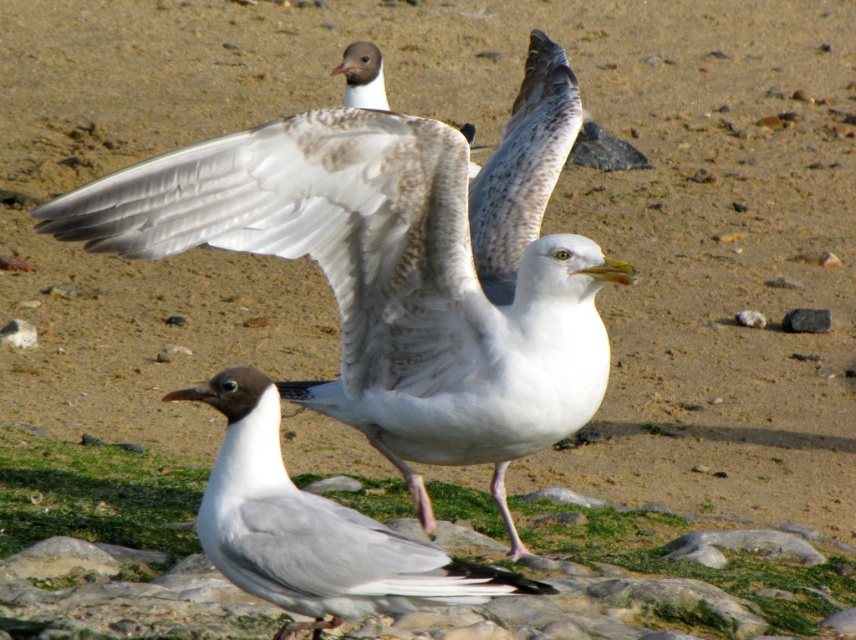
You are a photographer trying to capture a seagull in the center of your frame. The camera has a grid overlay with coordinates from 0 to 1 on both the x and y axes. According to the scene, where should you aim your camera to focus on the white feathered bird at center?

The white feathered bird at center is located at the 2D coordinates point of (400, 266). So you should aim your camera at that point to focus on the white feathered bird at center.

You are a photographer aiming to capture a closeup shot of both the white feathered bird at center and the gray matte seagull at center. Given that your camera lens has a maximum focus range of 80 centimeters, will you be able to photograph both birds in the same frame without moving the camera?

The white feathered bird at center and the gray matte seagull at center are 90.30 centimeters apart from each other. Since the camera lens has a maximum focus range of 80 centimeters, the distance between them exceeds this range. Therefore, you cannot photograph both birds in the same frame without moving the camera.

You are a photographer trying to capture a closeup shot of the white feathered bird at center and the gray matte seagull at center. Which bird should you focus on first if you want to photograph them both clearly in the same frame?

The white feathered bird at center is positioned on the right side of gray matte seagull at center. Since they are both at the same center position, you can focus on either one first as they are likely at a similar distance from the camera.